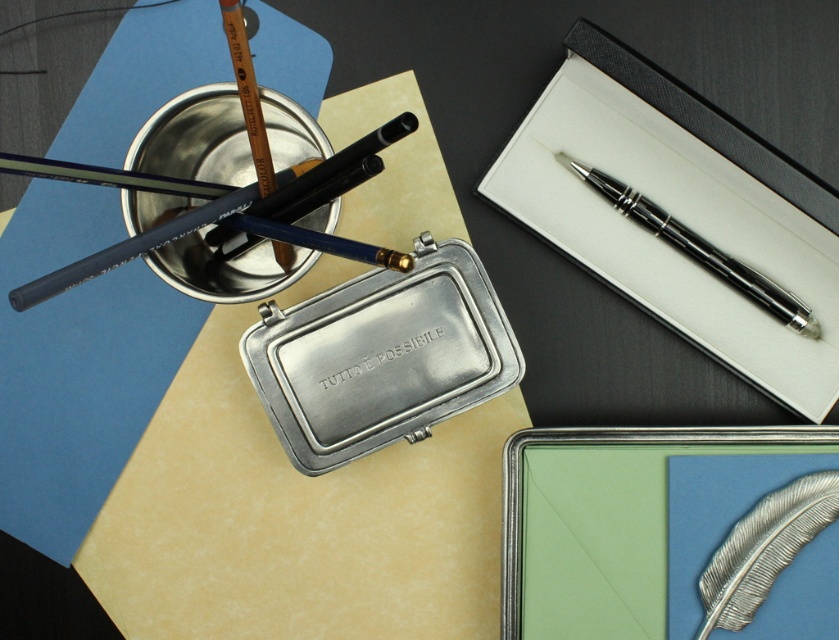
You are organizing stationery items on a desk and need to place the metallic pen at upper right and the matte black pencil at upper left. Since you have a limited space, which item requires more space due to its size?

The metallic pen at upper right requires more space because it has a larger size compared to the matte black pencil at upper left.

Consider the image. You are a student who needs to reach both the matte black pencil at upper left and the polished black pen at upper right during an exam. Can you comfortably reach both items if your arms can extend 10 inches? Explain.

The matte black pencil at upper left is 9.51 inches away from the polished black pen at upper right. Since your arms can extend 10 inches, you can comfortably reach both items as the distance between them is within your reach.

Looking at this image, you are organizing stationery items on a desk. You have a metallic pen at upper right and a polished black pen at upper right. If you want to place a 1.5 inch wide ruler between them, will there be enough space?

The metallic pen at upper right and polished black pen at upper right are 1.16 inches apart, which is less than the 1.5 inch width of the ruler. Therefore, there is not enough space to place the ruler between them.